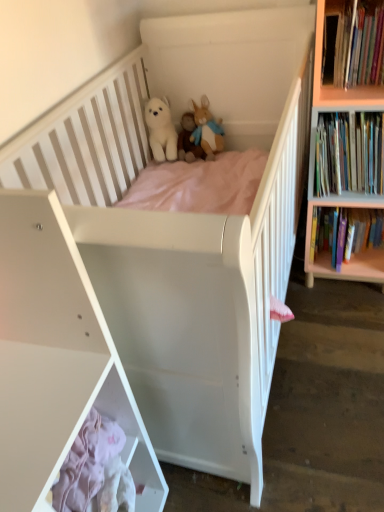
Where is `white matte cabinet at lower left`? white matte cabinet at lower left is located at coordinates (128, 437).

Measure the distance between point (14, 411) and camera.

30.08 inches.

At what (x,y) coordinates should I click in order to perform the action: click on light wood bookcase at right. Please return your answer as a coordinate pair (x, y). This screenshot has height=512, width=384. Looking at the image, I should click on (344, 192).

Measure the distance between point (x=327, y=203) and camera.

The depth of point (x=327, y=203) is 1.55 meters.

Describe the element at coordinates (161, 130) in the screenshot. I see `white plush bear at center, which is the 3th toy from right to left` at that location.

The height and width of the screenshot is (512, 384). What are the coordinates of `hardcover books at upper right, the 3th book ordered from the bottom` in the screenshot? It's located at (366, 44).

Is fluffy beige rabbit at upper center, the 1th toy from the right, not inside white plush bear at upper center, which is counted as the 2th toy, starting from the right?

That's incorrect, fluffy beige rabbit at upper center, the 1th toy from the right, is not completely outside white plush bear at upper center, which is counted as the 2th toy, starting from the right.

Considering the positions of objects fluffy beige rabbit at upper center, which is the 3th toy in left-to-right order, and white plush bear at upper center, which is counted as the 2th toy, starting from the right, in the image provided, who is behind, fluffy beige rabbit at upper center, which is the 3th toy in left-to-right order, or white plush bear at upper center, which is counted as the 2th toy, starting from the right,?

Positioned behind is white plush bear at upper center, which is counted as the 2th toy, starting from the right.

Measure the distance from fluffy beige rabbit at upper center, which is the 3th toy in left-to-right order, to white plush bear at upper center, the 2th toy from the left.

The distance of fluffy beige rabbit at upper center, which is the 3th toy in left-to-right order, from white plush bear at upper center, the 2th toy from the left, is 2.03 inches.

Is white plush bear at center, which is counted as the first toy, starting from the left, beside hardcover books at right, the 2th book viewed from the top?

They are not placed beside each other.

Does white plush bear at center, which is the 3th toy from right to left, have a greater height compared to hardcover books at right, the 2th book viewed from the top?

Incorrect, the height of white plush bear at center, which is the 3th toy from right to left, is not larger of that of hardcover books at right, the 2th book viewed from the top.

Which object is thinner, white plush bear at center, which is the 3th toy from right to left, or hardcover books at right, acting as the second book starting from the bottom?

white plush bear at center, which is the 3th toy from right to left, is thinner.

How far apart are white plush bear at center, which is the 3th toy from right to left, and hardcover books at right, acting as the second book starting from the bottom?

33.06 inches.

From the image's perspective, is white matte shelf at lower left located beneath white plush bear at upper center, which is counted as the 2th toy, starting from the right?

Yes, from the image's perspective, white matte shelf at lower left is beneath white plush bear at upper center, which is counted as the 2th toy, starting from the right.

Is white matte shelf at lower left looking in the opposite direction of white plush bear at upper center, which is counted as the 2th toy, starting from the right?

white matte shelf at lower left is not turned away from white plush bear at upper center, which is counted as the 2th toy, starting from the right.

Is white matte shelf at lower left far from white plush bear at upper center, the 2th toy from the left?

white matte shelf at lower left is far away from white plush bear at upper center, the 2th toy from the left.

How many degrees apart are the facing directions of white matte shelf at lower left and white plush bear at upper center, which is counted as the 2th toy, starting from the right?

There is a 88.6-degree angle between the facing directions of white matte shelf at lower left and white plush bear at upper center, which is counted as the 2th toy, starting from the right.

Which object is further away from the camera taking this photo, hardcover books at right, which ranks as the 3th book in top-to-bottom order, or white plush bear at upper center, the 2th toy from the left?

white plush bear at upper center, the 2th toy from the left, is further from the camera.

Looking at the image, does hardcover books at right, arranged as the first book when ordered from the bottom, seem bigger or smaller compared to white plush bear at upper center, the 2th toy from the left?

Considering their sizes, hardcover books at right, arranged as the first book when ordered from the bottom, takes up more space than white plush bear at upper center, the 2th toy from the left.

Which object is positioned more to the left, hardcover books at right, arranged as the first book when ordered from the bottom, or white plush bear at upper center, which is counted as the 2th toy, starting from the right?

white plush bear at upper center, which is counted as the 2th toy, starting from the right, is more to the left.

The image size is (384, 512). What are the coordinates of `the 3rd book to the right of the white plush bear at upper center, the 2th toy from the left, counting from the anchor's position` in the screenshot? It's located at (x=347, y=236).

Is light wood bookcase at right facing away from hardcover books at right, which ranks as the 3th book in top-to-bottom order?

Yes, light wood bookcase at right's orientation is away from hardcover books at right, which ranks as the 3th book in top-to-bottom order.

From the image's perspective, is light wood bookcase at right below hardcover books at right, arranged as the first book when ordered from the bottom?

Incorrect, from the image's perspective, light wood bookcase at right is higher than hardcover books at right, arranged as the first book when ordered from the bottom.

Is light wood bookcase at right spatially inside hardcover books at right, which ranks as the 3th book in top-to-bottom order, or outside of it?

light wood bookcase at right is located beyond the bounds of hardcover books at right, which ranks as the 3th book in top-to-bottom order.

Between light wood bookcase at right and hardcover books at right, arranged as the first book when ordered from the bottom, which one has smaller width?

With smaller width is hardcover books at right, arranged as the first book when ordered from the bottom.

From the image's perspective, is white plush bear at upper center, the 2th toy from the left, located beneath light wood bookcase at right?

No.

Which of these two, white plush bear at upper center, the 2th toy from the left, or light wood bookcase at right, is bigger?

light wood bookcase at right.

Is white plush bear at upper center, which is counted as the 2th toy, starting from the right, in contact with light wood bookcase at right?

No, white plush bear at upper center, which is counted as the 2th toy, starting from the right, is not next to light wood bookcase at right.

From the picture: Between white plush bear at upper center, which is counted as the 2th toy, starting from the right, and light wood bookcase at right, which one has larger width?

light wood bookcase at right is wider.

From a real-world perspective, between hardcover books at right, acting as the second book starting from the bottom, and light wood bookcase at right, who is vertically higher?

hardcover books at right, acting as the second book starting from the bottom, from a real-world perspective.

Does hardcover books at right, acting as the second book starting from the bottom, appear on the left side of light wood bookcase at right?

Correct, you'll find hardcover books at right, acting as the second book starting from the bottom, to the left of light wood bookcase at right.

Based on their sizes in the image, would you say hardcover books at right, the 2th book viewed from the top, is bigger or smaller than light wood bookcase at right?

In the image, hardcover books at right, the 2th book viewed from the top, appears to be smaller than light wood bookcase at right.

What are the coordinates of `the 1st toy above the white plush bear at upper center, which is counted as the 2th toy, starting from the right (from the image's perspective)` in the screenshot? It's located at (207, 129).

Which toy is the 3rd one when counting from the left side of the hardcover books at right, acting as the second book starting from the bottom? Please provide its 2D coordinates.

[(161, 130)]

From the picture: Looking at the image, which one is located further to hardcover books at right, which ranks as the 3th book in top-to-bottom order, hardcover books at upper right, arranged as the 1th book when viewed from the top, or hardcover books at right, the 2th book viewed from the top?

Among the two, hardcover books at upper right, arranged as the 1th book when viewed from the top, is located further to hardcover books at right, which ranks as the 3th book in top-to-bottom order.

From the image, which object appears to be farther from white plush bear at center, which is the 3th toy from right to left, fluffy beige rabbit at upper center, which is the 3th toy in left-to-right order, or hardcover books at right, the 2th book viewed from the top?

The object further to white plush bear at center, which is the 3th toy from right to left, is hardcover books at right, the 2th book viewed from the top.

Considering their positions, is fluffy beige rabbit at upper center, the 1th toy from the right, positioned closer to hardcover books at upper right, the 3th book ordered from the bottom, than white plush bear at upper center, the 2th toy from the left?

Based on the image, fluffy beige rabbit at upper center, the 1th toy from the right, appears to be nearer to hardcover books at upper right, the 3th book ordered from the bottom.

When comparing their distances from hardcover books at right, which ranks as the 3th book in top-to-bottom order, does white matte cabinet at lower left or light wood bookcase at right seem further?

white matte cabinet at lower left lies further to hardcover books at right, which ranks as the 3th book in top-to-bottom order, than the other object.

Considering their positions, is white matte shelf at lower left positioned closer to hardcover books at right, which ranks as the 3th book in top-to-bottom order, than hardcover books at upper right, arranged as the 1th book when viewed from the top?

The object closer to hardcover books at right, which ranks as the 3th book in top-to-bottom order, is hardcover books at upper right, arranged as the 1th book when viewed from the top.

Looking at the image, which one is located closer to white plush bear at center, which is counted as the first toy, starting from the left, hardcover books at right, the 2th book viewed from the top, or white matte cabinet at lower left?

Among the two, hardcover books at right, the 2th book viewed from the top, is located nearer to white plush bear at center, which is counted as the first toy, starting from the left.

Considering their positions, is white plush bear at upper center, which is counted as the 2th toy, starting from the right, positioned further to white plush bear at center, which is the 3th toy from right to left, than white matte cabinet at lower left?

white matte cabinet at lower left.

Considering their positions, is white matte shelf at lower left positioned closer to hardcover books at right, which ranks as the 3th book in top-to-bottom order, than white matte cabinet at lower left?

white matte cabinet at lower left lies closer to hardcover books at right, which ranks as the 3th book in top-to-bottom order, than the other object.

The height and width of the screenshot is (512, 384). In order to click on bookcase between white matte shelf at lower left and white plush bear at upper center, the 2th toy from the left, in the front-back direction in this screenshot , I will do `click(344, 192)`.

The height and width of the screenshot is (512, 384). What are the coordinates of `toy located between white plush bear at upper center, which is counted as the 2th toy, starting from the right, and hardcover books at right, arranged as the first book when ordered from the bottom, in the left-right direction` in the screenshot? It's located at (207, 129).

Locate an element on the screen. bookcase between hardcover books at upper right, the 3th book ordered from the bottom, and hardcover books at right, arranged as the first book when ordered from the bottom, in the up-down direction is located at coordinates (344, 192).

Where is `toy located between white plush bear at upper center, which is counted as the 2th toy, starting from the right, and hardcover books at right, the 2th book viewed from the top, in the left-right direction`? Image resolution: width=384 pixels, height=512 pixels. toy located between white plush bear at upper center, which is counted as the 2th toy, starting from the right, and hardcover books at right, the 2th book viewed from the top, in the left-right direction is located at coordinates (207, 129).